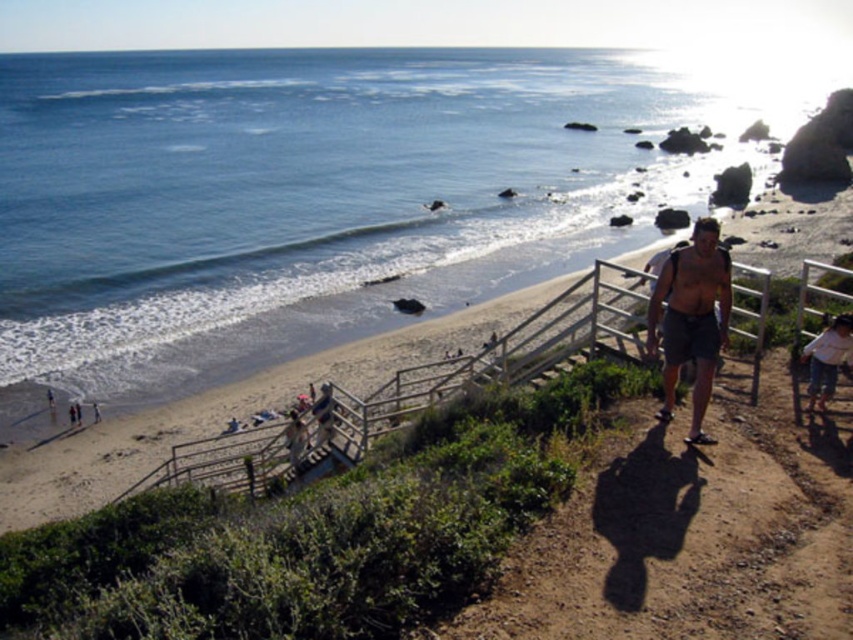
Consider the image. Is the position of white cotton shirt at lower right less distant than that of light brown wooden stick at lower left?

Yes, white cotton shirt at lower right is closer to the viewer.

Is point (843, 317) closer to camera compared to point (94, 412)?

Yes, point (843, 317) is in front of point (94, 412).

Does point (850, 365) come farther from viewer compared to point (93, 401)?

No, (850, 365) is closer to viewer.

In order to click on white cotton shirt at lower right in this screenshot , I will do `click(827, 358)`.

Between gray shorts at right and light brown wooden stick at lower left, which one has more height?

gray shorts at right is taller.

In the scene shown: Which is above, gray shorts at right or light brown wooden stick at lower left?

gray shorts at right is above.

In order to click on gray shorts at right in this screenshot , I will do `click(692, 317)`.

Does gray shorts at right have a larger size compared to white cotton shirt at lower right?

Indeed, gray shorts at right has a larger size compared to white cotton shirt at lower right.

Does point (692, 272) come farther from viewer compared to point (845, 356)?

No, it is not.

Locate an element on the screen. This screenshot has height=640, width=853. gray shorts at right is located at coordinates (692, 317).